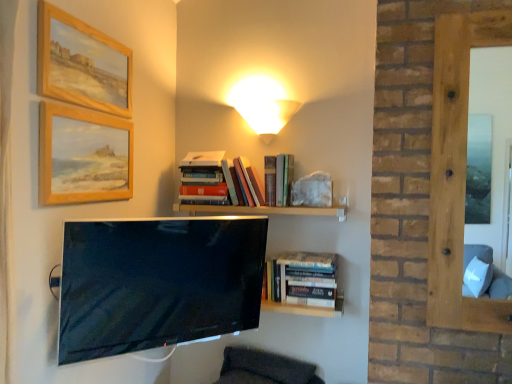
Identify the location of free region under dark gray fabric swivel chair at lower center (from a real-world perspective). This screenshot has width=512, height=384. (257, 380).